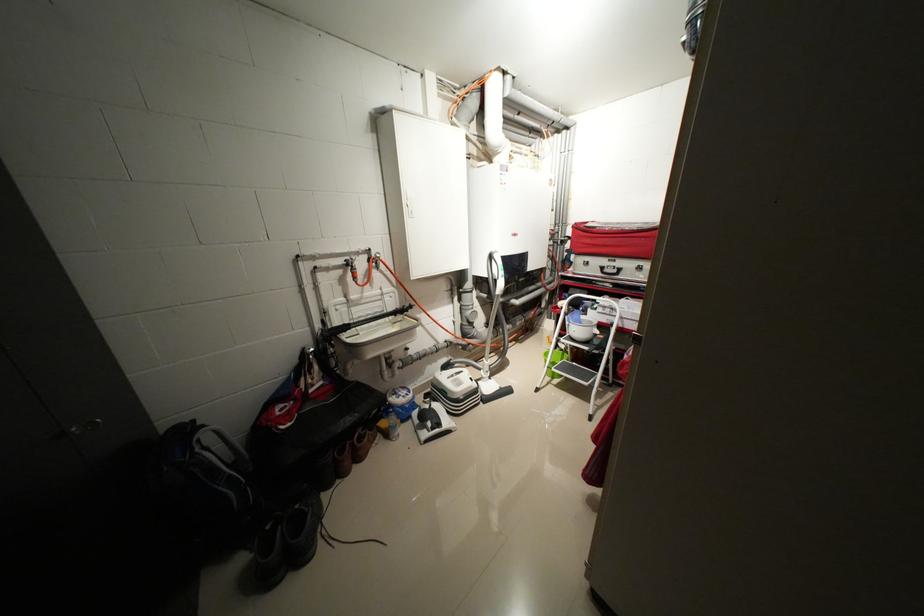
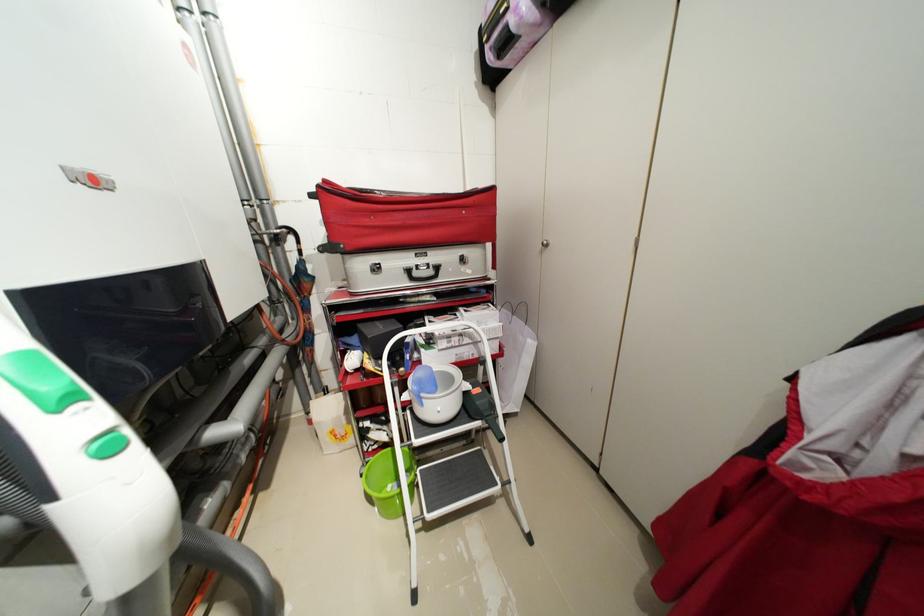
In the second image, find the point that corresponds to the point at 609,338 in the first image.

(484, 391)